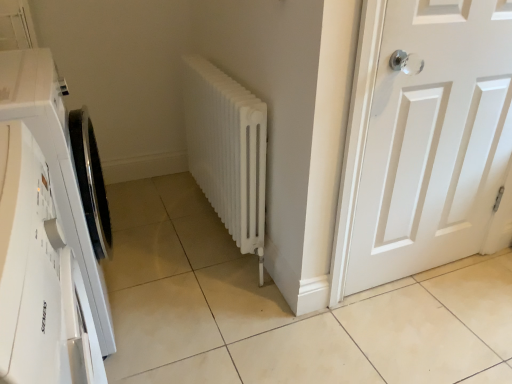
Question: Is point (38, 357) positioned closer to the camera than point (425, 248)?

Choices:
 (A) farther
 (B) closer

Answer: (B)

Question: Is white matte/waterproof washing machine at left wider or thinner than white matte door at right?

Choices:
 (A) thin
 (B) wide

Answer: (B)

Question: Which object is the closest to the white matte/waterproof washing machine at left?

Choices:
 (A) white matte door at right
 (B) white matte radiator at center

Answer: (B)

Question: Estimate the real-world distances between objects in this image. Which object is closer to the white matte/waterproof washing machine at left?

Choices:
 (A) white matte radiator at center
 (B) white matte door at right

Answer: (A)